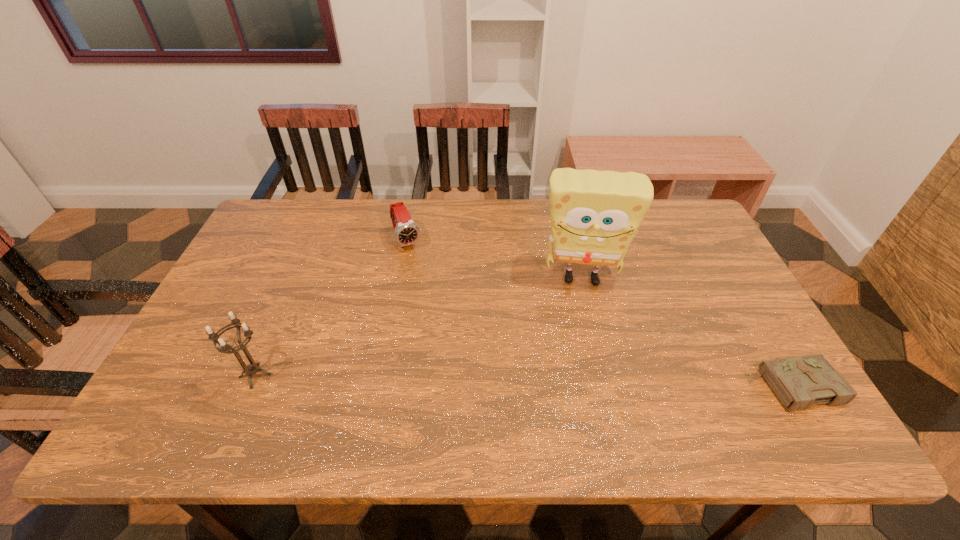
Where is `free space located on the face of the third nearest object`? This screenshot has height=540, width=960. free space located on the face of the third nearest object is located at coordinates (585, 377).

Identify the location of free space located on the face of the third nearest object. (581, 317).

Where is `free point located on the face of the second shortest object`? free point located on the face of the second shortest object is located at coordinates (420, 270).

At what (x,y) coordinates should I click in order to perform the action: click on free point located 0.210m on the face of the second shortest object. Please return your answer as a coordinate pair (x, y). The image size is (960, 540). Looking at the image, I should click on (436, 299).

You are a GUI agent. You are given a task and a screenshot of the screen. Output one action in this format:
    pyautogui.click(x=<x>, y=<y>)
    Task: Click on the vacant area situated on the face of the second shortest object
    
    Given the screenshot: What is the action you would take?
    pyautogui.click(x=428, y=283)

Locate an element on the screen. object located in the far edge section of the desktop is located at coordinates (406, 232).

At what (x,y) coordinates should I click in order to perform the action: click on candle holder positioned at the near edge. Please return your answer as a coordinate pair (x, y). The image size is (960, 540). Looking at the image, I should click on (251, 369).

Where is `diary present at the near edge`? The height and width of the screenshot is (540, 960). diary present at the near edge is located at coordinates (798, 382).

At what (x,y) coordinates should I click in order to perform the action: click on object that is positioned at the left edge. Please return your answer as a coordinate pair (x, y). Looking at the image, I should click on (251, 369).

Identify the location of object that is at the right edge. The height and width of the screenshot is (540, 960). point(798,382).